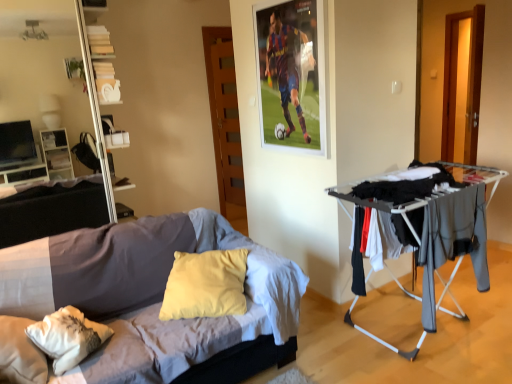
Question: Are white glossy bookshelf at upper left and soft cotton bed at center beside each other?

Choices:
 (A) no
 (B) yes

Answer: (A)

Question: Is white glossy bookshelf at upper left to the right of soft cotton bed at center from the viewer's perspective?

Choices:
 (A) yes
 (B) no

Answer: (B)

Question: Could you tell me if white glossy bookshelf at upper left is facing soft cotton bed at center?

Choices:
 (A) no
 (B) yes

Answer: (A)

Question: Is the depth of white glossy bookshelf at upper left less than that of soft cotton bed at center?

Choices:
 (A) no
 (B) yes

Answer: (A)

Question: Is the position of white glossy bookshelf at upper left more distant than that of soft cotton bed at center?

Choices:
 (A) no
 (B) yes

Answer: (B)

Question: Is soft cotton bed at center completely or partially inside white glossy bookshelf at upper left?

Choices:
 (A) yes
 (B) no

Answer: (B)

Question: Is white glossy entertainment center at left next to soft cotton bed at center?

Choices:
 (A) no
 (B) yes

Answer: (A)

Question: Is white glossy entertainment center at left bigger than soft cotton bed at center?

Choices:
 (A) no
 (B) yes

Answer: (A)

Question: Does white glossy entertainment center at left have a lesser width compared to soft cotton bed at center?

Choices:
 (A) no
 (B) yes

Answer: (B)

Question: Considering the relative positions of white glossy entertainment center at left and soft cotton bed at center in the image provided, is white glossy entertainment center at left to the left of soft cotton bed at center from the viewer's perspective?

Choices:
 (A) yes
 (B) no

Answer: (A)

Question: Is white glossy entertainment center at left not inside soft cotton bed at center?

Choices:
 (A) no
 (B) yes

Answer: (B)

Question: Is the position of white glossy entertainment center at left more distant than that of soft cotton bed at center?

Choices:
 (A) no
 (B) yes

Answer: (B)

Question: Is white glossy bookshelf at upper left smaller than white glossy entertainment center at left?

Choices:
 (A) no
 (B) yes

Answer: (A)